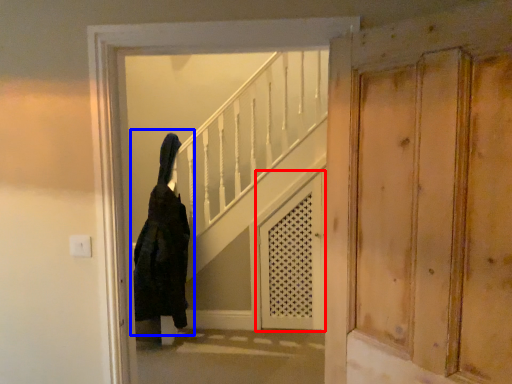
Question: Which point is further to the camera, screen door (highlighted by a red box) or woman (highlighted by a blue box)?

Choices:
 (A) screen door
 (B) woman

Answer: (A)